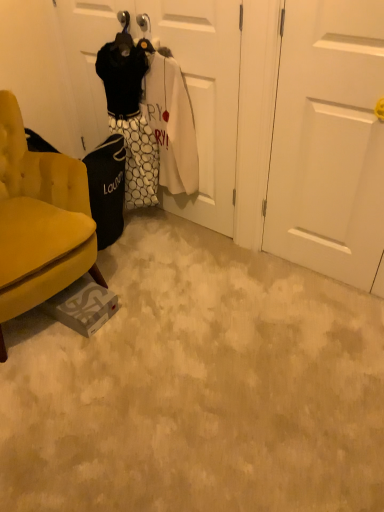
Question: Does white matte door at center, marked as the 1th door in a right-to-left arrangement, have a greater width compared to velvet yellow armchair at lower left?

Choices:
 (A) no
 (B) yes

Answer: (A)

Question: From the image's perspective, is white matte door at center, which appears as the second door when viewed from the left, on velvet yellow armchair at lower left?

Choices:
 (A) yes
 (B) no

Answer: (A)

Question: Is white matte door at center, marked as the 1th door in a right-to-left arrangement, thinner than velvet yellow armchair at lower left?

Choices:
 (A) yes
 (B) no

Answer: (A)

Question: Is white matte door at center, marked as the 1th door in a right-to-left arrangement, aimed at velvet yellow armchair at lower left?

Choices:
 (A) yes
 (B) no

Answer: (B)

Question: Does white matte door at center, which appears as the second door when viewed from the left, appear on the right side of velvet yellow armchair at lower left?

Choices:
 (A) yes
 (B) no

Answer: (A)

Question: Considering the positions of white matte door at center, which appears as the second door when viewed from the left, and white matte door at center, which is the 1th door in left-to-right order, in the image, is white matte door at center, which appears as the second door when viewed from the left, bigger or smaller than white matte door at center, which is the 1th door in left-to-right order,?

Choices:
 (A) big
 (B) small

Answer: (B)

Question: From their relative heights in the image, would you say white matte door at center, marked as the 1th door in a right-to-left arrangement, is taller or shorter than white matte door at center, which is the 1th door in left-to-right order?

Choices:
 (A) short
 (B) tall

Answer: (B)

Question: From the image's perspective, relative to white matte door at center, which ranks as the 2th door in right-to-left order, is white matte door at center, marked as the 1th door in a right-to-left arrangement, above or below?

Choices:
 (A) below
 (B) above

Answer: (A)

Question: From a real-world perspective, relative to white matte door at center, which is the 1th door in left-to-right order, is white matte door at center, which appears as the second door when viewed from the left, vertically above or below?

Choices:
 (A) above
 (B) below

Answer: (A)

Question: From a real-world perspective, is velvet yellow armchair at lower left positioned above or below white matte door at center, which appears as the second door when viewed from the left?

Choices:
 (A) below
 (B) above

Answer: (A)

Question: Looking at their shapes, would you say velvet yellow armchair at lower left is wider or thinner than white matte door at center, which appears as the second door when viewed from the left?

Choices:
 (A) wide
 (B) thin

Answer: (A)

Question: In terms of height, does velvet yellow armchair at lower left look taller or shorter compared to white matte door at center, which appears as the second door when viewed from the left?

Choices:
 (A) short
 (B) tall

Answer: (A)

Question: In the image, is velvet yellow armchair at lower left positioned in front of or behind white matte door at center, which appears as the second door when viewed from the left?

Choices:
 (A) behind
 (B) front

Answer: (B)

Question: In terms of size, does white matte door at center, which is the 1th door in left-to-right order, appear bigger or smaller than velvet yellow armchair at lower left?

Choices:
 (A) small
 (B) big

Answer: (A)

Question: Is point (170, 31) positioned closer to the camera than point (36, 202)?

Choices:
 (A) closer
 (B) farther

Answer: (A)